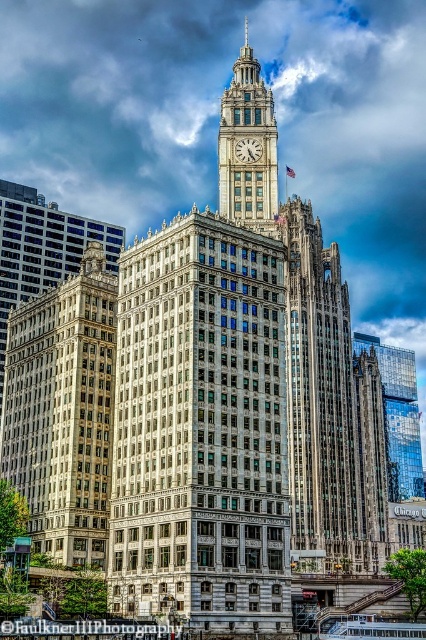
You are standing in front of the grand historic skyscraper and want to take a photo of both the white stone building at center and the beige stone clock tower at center. Which one will appear larger in your photo?

The white stone building at center will appear larger in the photo because it is closer to the viewer than the beige stone clock tower at center.